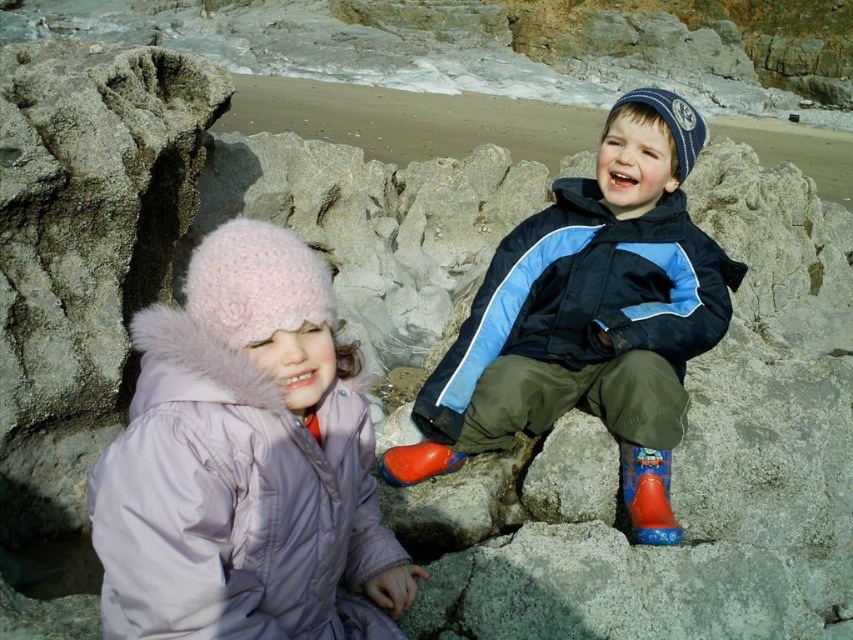
You are standing on the rocky beach and want to place a small flag at the point closer to you. Which point should you choose between point (317, 413) and point (641, 474)?

Point (317, 413) is closer to the viewer than point (641, 474), so you should choose point (317, 413) to place the small flag.